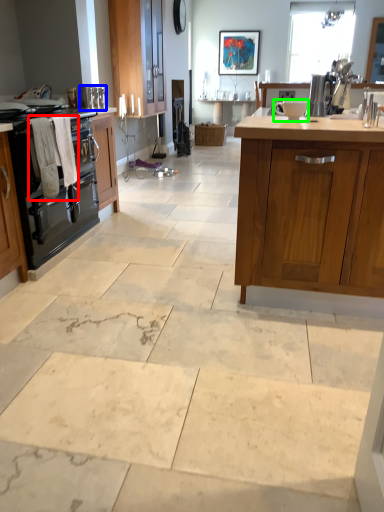
Question: Which object is positioned farthest from laundry (highlighted by a red box)? Select from appliance (highlighted by a blue box) and appliance (highlighted by a green box).

Choices:
 (A) appliance
 (B) appliance

Answer: (B)